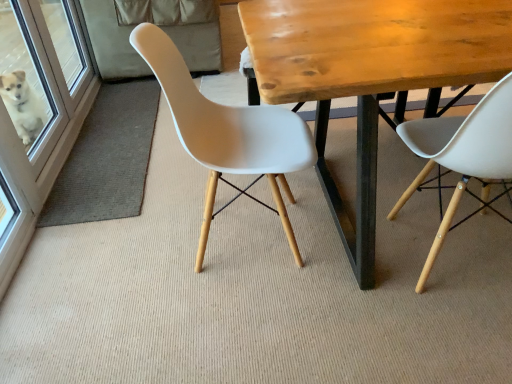
Where is `free area in between white plastic chair at right, which is the 1th chair in right-to-left order, and wooden table at center`? The width and height of the screenshot is (512, 384). free area in between white plastic chair at right, which is the 1th chair in right-to-left order, and wooden table at center is located at coordinates (369, 300).